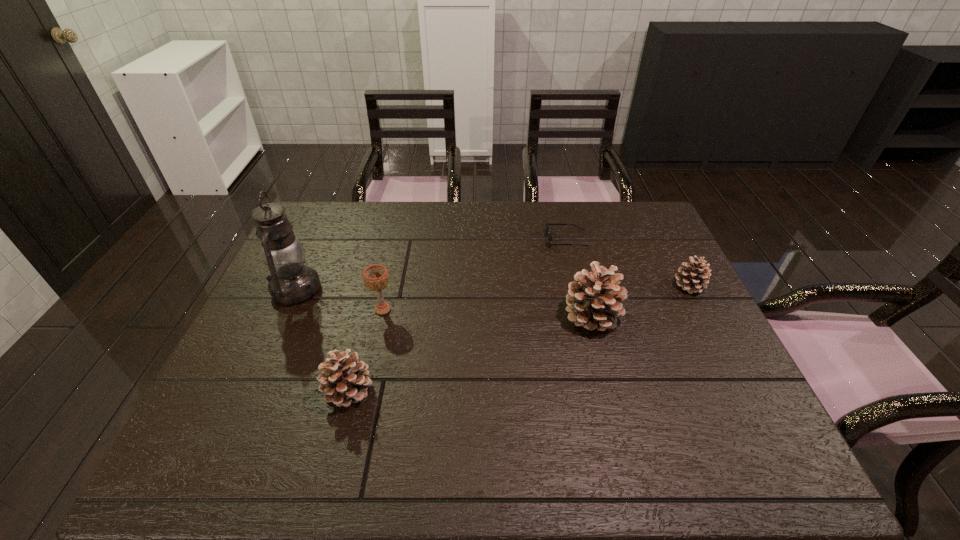
Identify the location of vacant space that's between the second shortest pinecone and the farthest object. This screenshot has width=960, height=540. (458, 315).

Find the location of a particular element. The image size is (960, 540). vacant region between the oil lamp and the tallest pinecone is located at coordinates (444, 302).

Identify the location of vacant space that is in between the chalice and the second pinecone from right to left. (488, 313).

This screenshot has height=540, width=960. What are the coordinates of `free spot between the leftmost object and the second shortest object` in the screenshot? It's located at (492, 288).

Where is `empty space between the sunglasses and the rightmost object`? empty space between the sunglasses and the rightmost object is located at coordinates (628, 262).

Locate an element on the screen. unoccupied position between the oil lamp and the chalice is located at coordinates (339, 300).

This screenshot has width=960, height=540. Find the location of `free space between the chalice and the sunglasses`. free space between the chalice and the sunglasses is located at coordinates (474, 274).

The image size is (960, 540). In order to click on free space between the nearest pinecone and the tallest object in this screenshot , I will do `click(323, 340)`.

At what (x,y) coordinates should I click in order to perform the action: click on blank region between the leftmost object and the nearest object. Please return your answer as a coordinate pair (x, y). The height and width of the screenshot is (540, 960). Looking at the image, I should click on (323, 340).

You are a GUI agent. You are given a task and a screenshot of the screen. Output one action in this format:
    pyautogui.click(x=<x>, y=<y>)
    Task: Click on the free space between the leftmost pinecone and the fifth shortest object
    
    Given the screenshot: What is the action you would take?
    pyautogui.click(x=470, y=353)